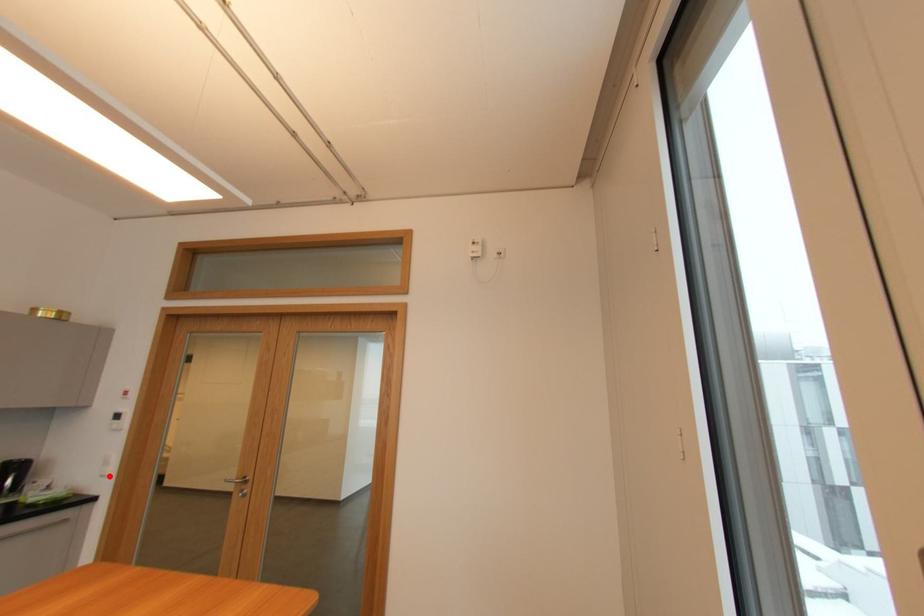
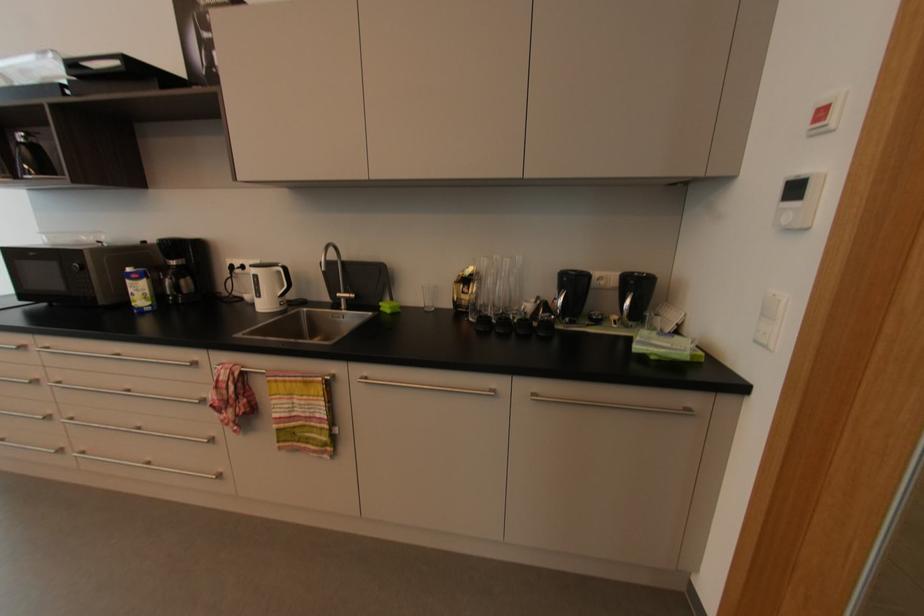
In the second image, find the point that corresponds to the highlighted location in the first image.

(769, 347)